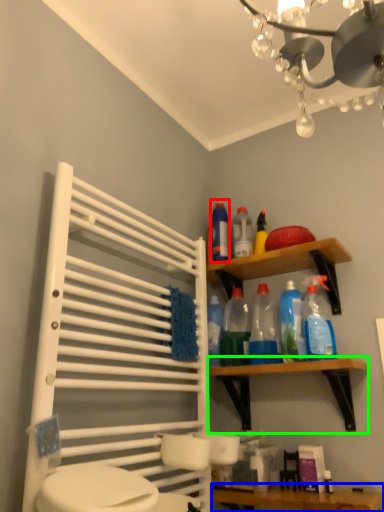
Question: Which is farther away from cleaning product (highlighted by a red box)? vanity (highlighted by a blue box) or shelf (highlighted by a green box)?

Choices:
 (A) vanity
 (B) shelf

Answer: (A)